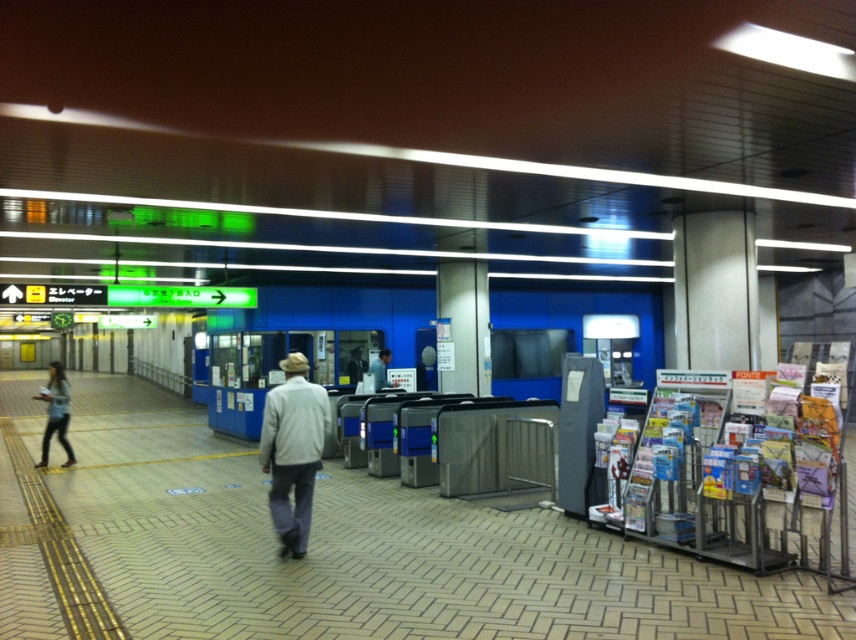
Who is taller, light gray fabric jacket at center or light blue shirt at center?

With more height is light gray fabric jacket at center.

Is point (284, 396) positioned in front of point (388, 358)?

Yes, point (284, 396) is in front of point (388, 358).

The height and width of the screenshot is (640, 856). What are the coordinates of `light gray fabric jacket at center` in the screenshot? It's located at (293, 451).

Image resolution: width=856 pixels, height=640 pixels. I want to click on light gray fabric jacket at center, so click(293, 451).

Is point (296, 412) positioned before point (39, 396)?

Yes, point (296, 412) is closer to viewer.

Does point (295, 448) come in front of point (64, 435)?

That is True.

Locate an element on the screen. The width and height of the screenshot is (856, 640). light gray fabric jacket at center is located at coordinates (293, 451).

Between denim jacket at left and light blue shirt at center, which one has less height?

light blue shirt at center is shorter.

Is denim jacket at left closer to the viewer compared to light blue shirt at center?

Yes, denim jacket at left is in front of light blue shirt at center.

Does point (58, 387) come in front of point (385, 364)?

Yes, point (58, 387) is in front of point (385, 364).

Locate an element on the screen. denim jacket at left is located at coordinates (55, 412).